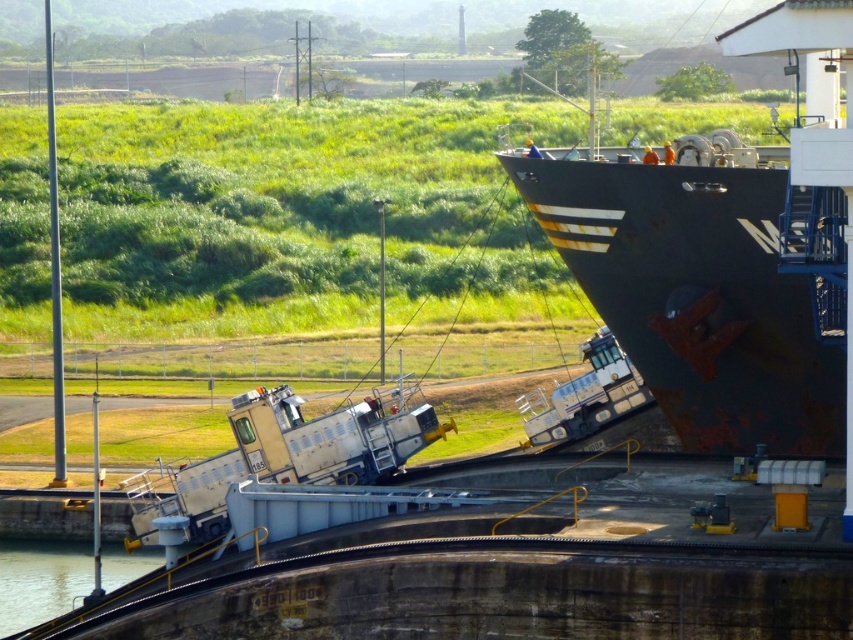
In the scene shown: You are a maritime engineer assessing the Panama Canal locks. You observe the rusty metal ship at right and the clear water at bottom left. Which object occupies a greater area within the lock chamber?

The rusty metal ship at right has a larger size compared to the clear water at bottom left, so it occupies a greater area within the lock chamber.